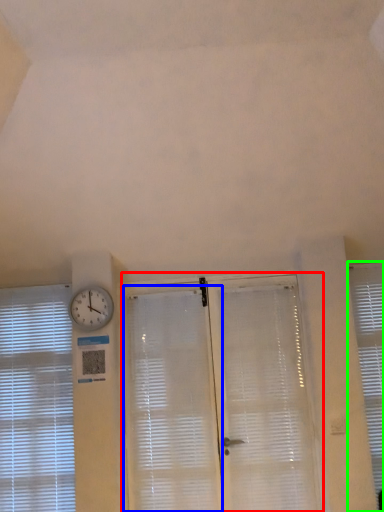
Question: Which is farther away from screen door (highlighted by a red box)? shutter (highlighted by a blue box) or window blind (highlighted by a green box)?

Choices:
 (A) shutter
 (B) window blind

Answer: (B)